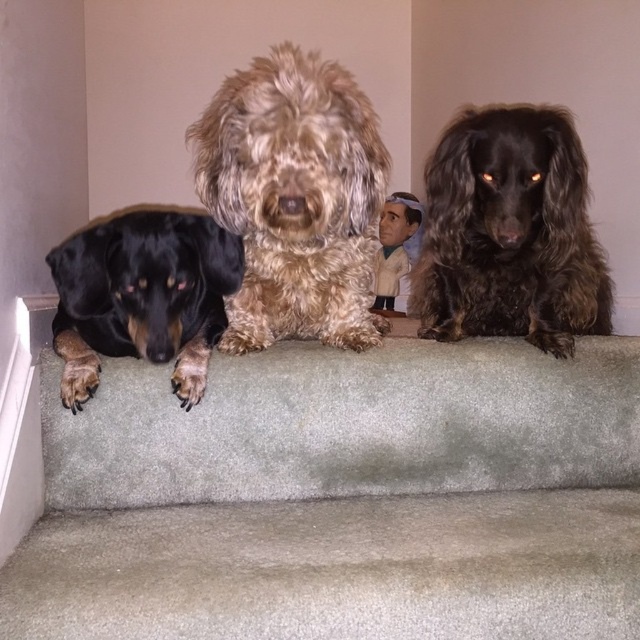
You are a photographer setting up a tripod to capture a closeup of the fuzzy brown dog at center and the shiny brown fur at center. The tripod has a minimum distance requirement of 10 inches between the two subjects to focus properly. Will the current spacing between them allow for a clear focus?

The distance between the fuzzy brown dog at center and the shiny brown fur at center is 11.04 inches, which exceeds the tripod minimum requirement of 10 inches. Therefore, the current spacing allows for a clear focus.

You are a photographer trying to capture the fuzzy brown dog at center and the shiny brown fur at center. Since the lighting is better in front, which dog should you focus on to get a clearer shot?

The fuzzy brown dog at center is in front of the shiny brown fur at center, so focusing on the fuzzy brown dog at center would result in a clearer shot due to better lighting in front.

You are standing at the bottom of the staircase and want to pet the dogs. Which dog, the fuzzy brown dog at center or the black matte dog at left, is closer to you?

The fuzzy brown dog at center is closer to the viewer than the black matte dog at left, so you can reach the fuzzy brown dog at center first.